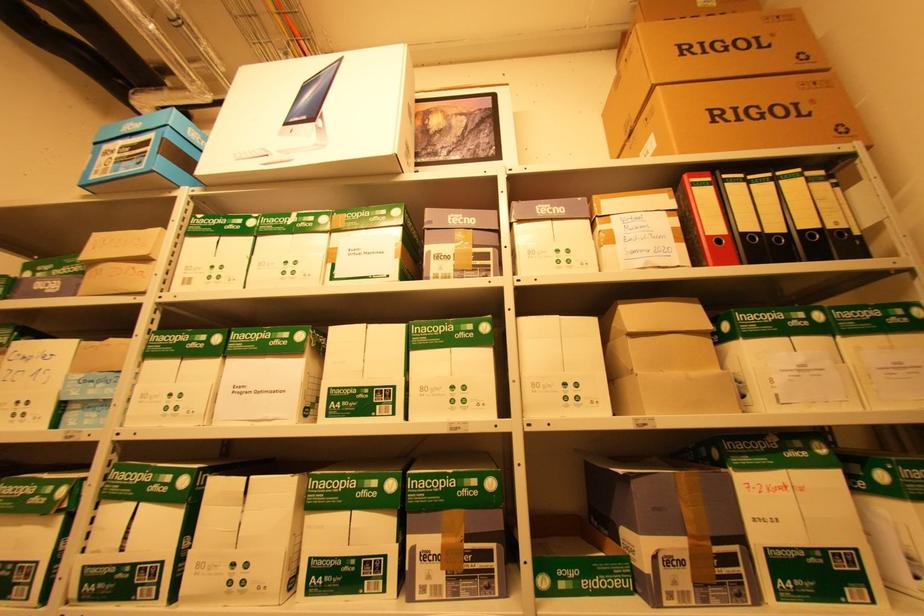
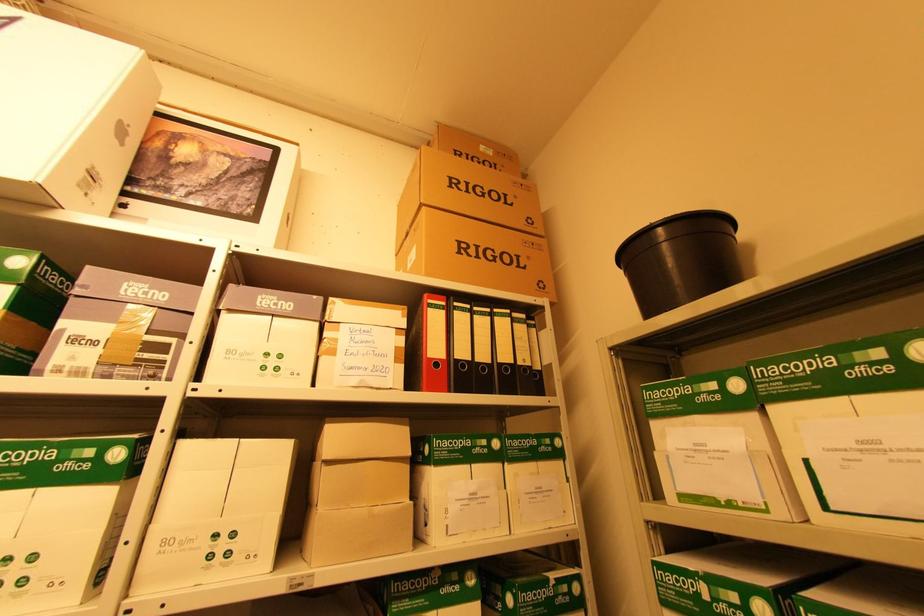
Question: How did the camera likely rotate?

Choices:
 (A) Left
 (B) Right
 (C) Up
 (D) Down

Answer: (B)